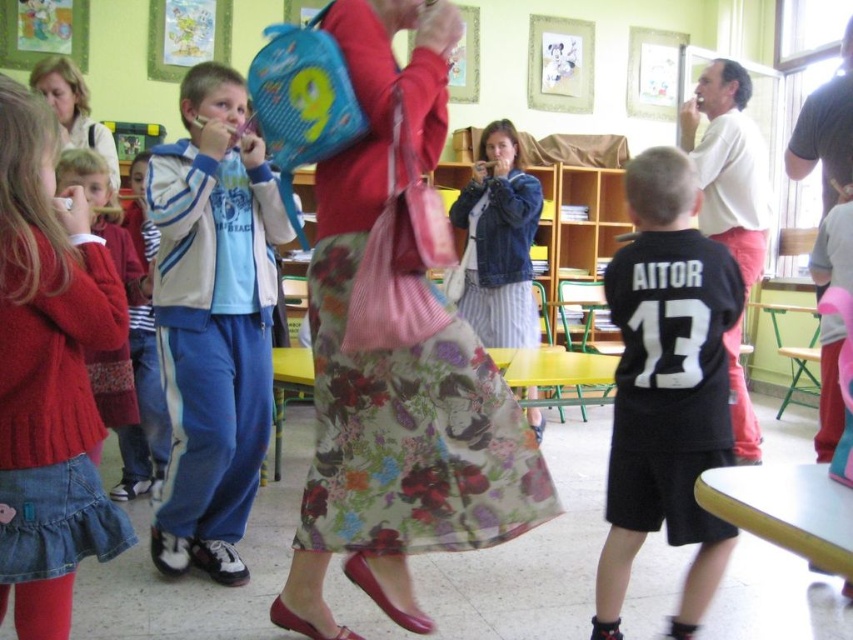
You are a student in the classroom and need to decide which clothing item is wider between the floral fabric skirt at center and the black jersey at center. Which one is wider?

The floral fabric skirt at center is wider than the black jersey at center because the description states that the floral fabric skirt at center surpasses the black jersey at center in width.

You are a student in the classroom and want to hand your homework to the teacher standing at the front. The teacher is wearing a floral fabric dress at center and a white cotton shirt at upper right. Which article of clothing should you look for to identify the teacher?

The teacher is wearing both the floral fabric dress at center and the white cotton shirt at upper right. Since the floral fabric dress at center is positioned on the left side of the white cotton shirt at upper right, you can identify the teacher by looking for the white cotton shirt at upper right located to the right of the floral fabric dress at center.